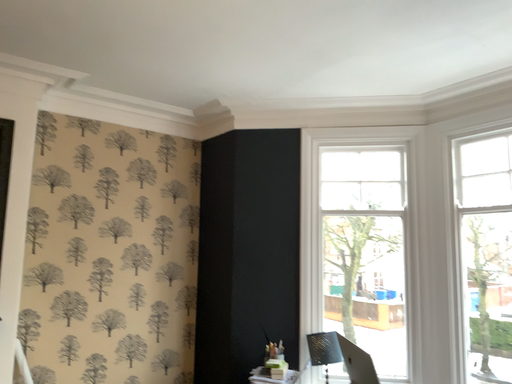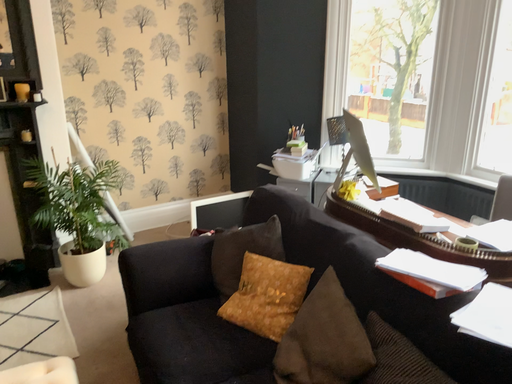
Question: How did the camera likely rotate when shooting the video?

Choices:
 (A) rotated downward
 (B) rotated upward

Answer: (A)